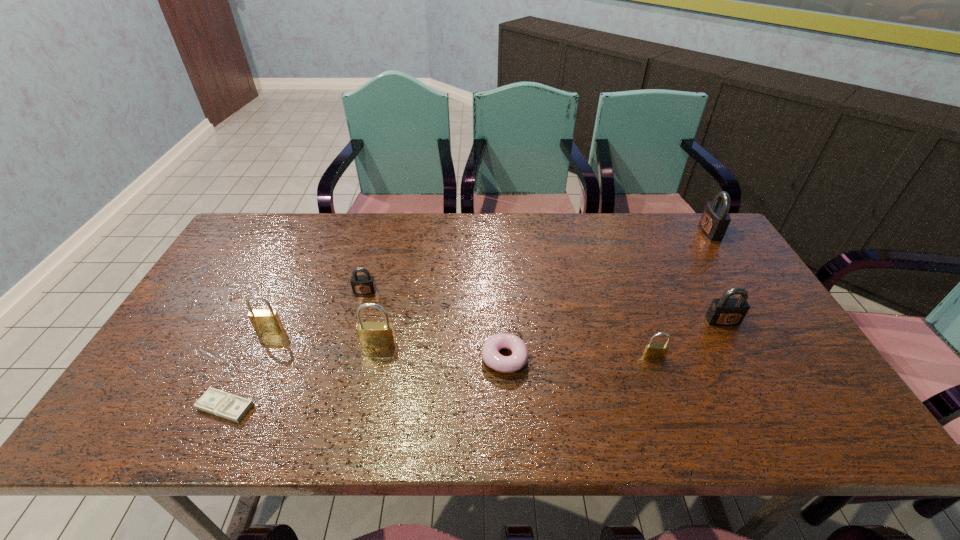
The image size is (960, 540). Identify the location of empty space between the second brass padlock from left to right and the nearest object. click(x=302, y=376).

This screenshot has width=960, height=540. Find the location of `vacant point located between the farthest padlock and the shortest object`. vacant point located between the farthest padlock and the shortest object is located at coordinates (468, 319).

Locate an element on the screen. This screenshot has height=540, width=960. vacant area that lies between the second nearest padlock and the nearest object is located at coordinates (302, 376).

In order to click on vacant area between the leftmost padlock and the nearest object in this screenshot , I will do `click(248, 367)`.

The height and width of the screenshot is (540, 960). Find the location of `object that is the third closest to the farthest brass padlock`. object that is the third closest to the farthest brass padlock is located at coordinates (372, 335).

The height and width of the screenshot is (540, 960). What are the coordinates of `the sixth closest object relative to the nearest brass padlock` in the screenshot? It's located at (214, 401).

The image size is (960, 540). I want to click on padlock that can be found as the third closest to the fifth nearest padlock, so click(653, 351).

Identify which padlock is the fifth closest to the biggest gray padlock. Please provide its 2D coordinates. Your answer should be formatted as a tuple, i.e. [(x, y)], where the tuple contains the x and y coordinates of a point satisfying the conditions above.

[(262, 320)]

At what (x,y) coordinates should I click in order to perform the action: click on the closest gray padlock to the second farthest gray padlock. Please return your answer as a coordinate pair (x, y). The height and width of the screenshot is (540, 960). Looking at the image, I should click on (725, 311).

You are a GUI agent. You are given a task and a screenshot of the screen. Output one action in this format:
    pyautogui.click(x=<x>, y=<y>)
    Task: Click on the gray padlock that is the closest to the second biggest brass padlock
    The width and height of the screenshot is (960, 540).
    Given the screenshot: What is the action you would take?
    pyautogui.click(x=365, y=284)